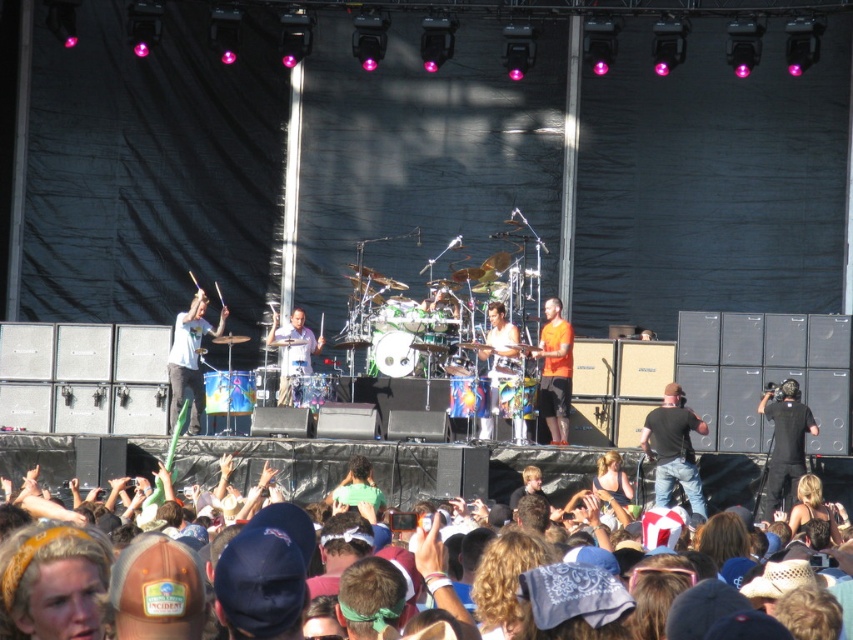
Question: Which point is closer to the camera?

Choices:
 (A) (403, 321)
 (B) (187, 312)
 (C) (271, 328)
 (D) (497, 371)

Answer: (D)

Question: Which point is closer to the camera?

Choices:
 (A) (357, 289)
 (B) (506, 358)

Answer: (B)

Question: Can you confirm if multicolored fabric at lower center is positioned above white t-shirt at center?

Choices:
 (A) yes
 (B) no

Answer: (B)

Question: Does multicolored fabric at lower center appear under matte blue drum set at center?

Choices:
 (A) yes
 (B) no

Answer: (A)

Question: Among these objects, which one is farthest from the camera?

Choices:
 (A) orange cotton shirt at center
 (B) white t-shirt at center
 (C) matte blue drum set at center

Answer: (A)

Question: Does multicolored fabric at lower center appear under orange cotton shirt at center?

Choices:
 (A) yes
 (B) no

Answer: (A)